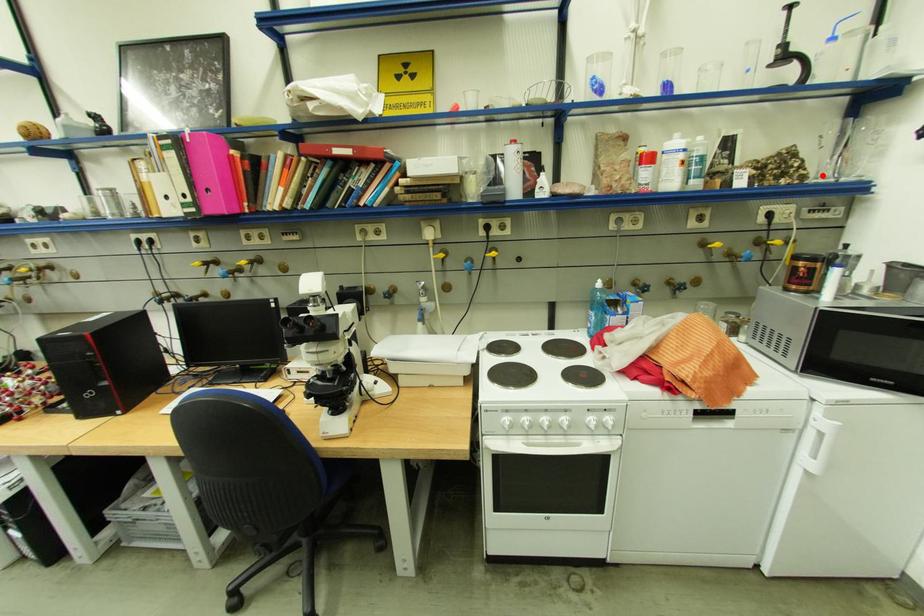
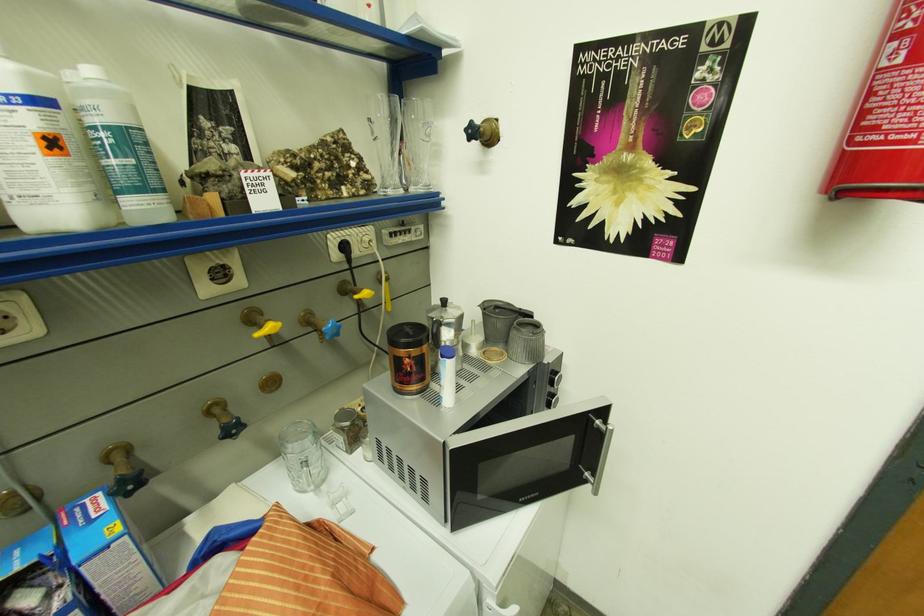
Find the pixel in the second image that matches the highlighted location in the first image.

(387, 182)